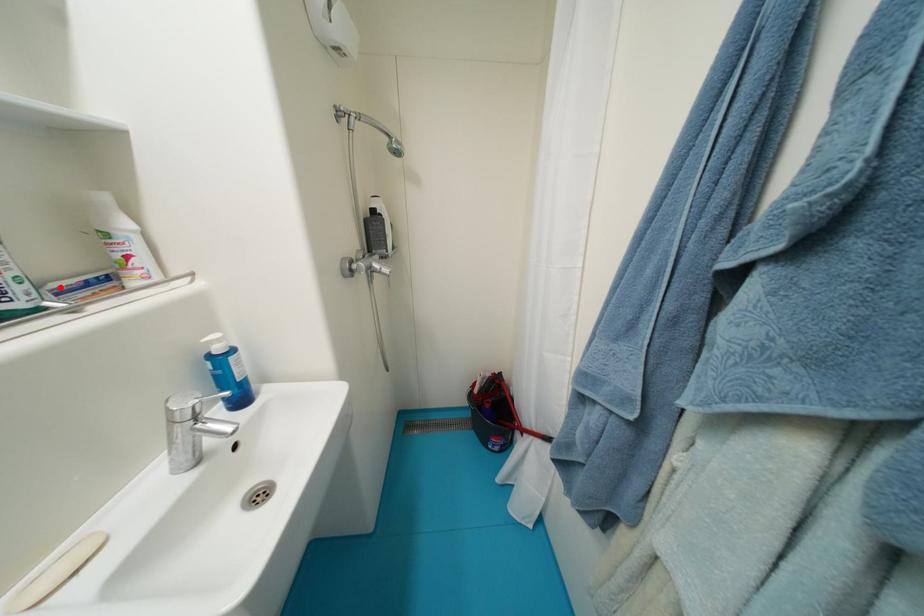
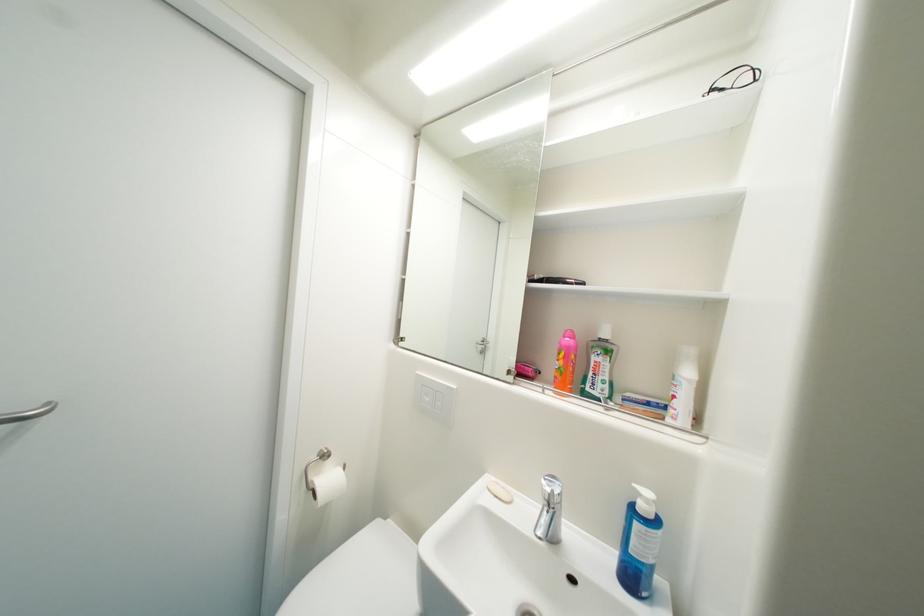
Question: I am providing you with two images of the same scene from different viewpoints. A red point is marked on the first image. At the location where the point appears in image 1, is it still visible in image 2?

Choices:
 (A) Yes
 (B) No

Answer: (A)